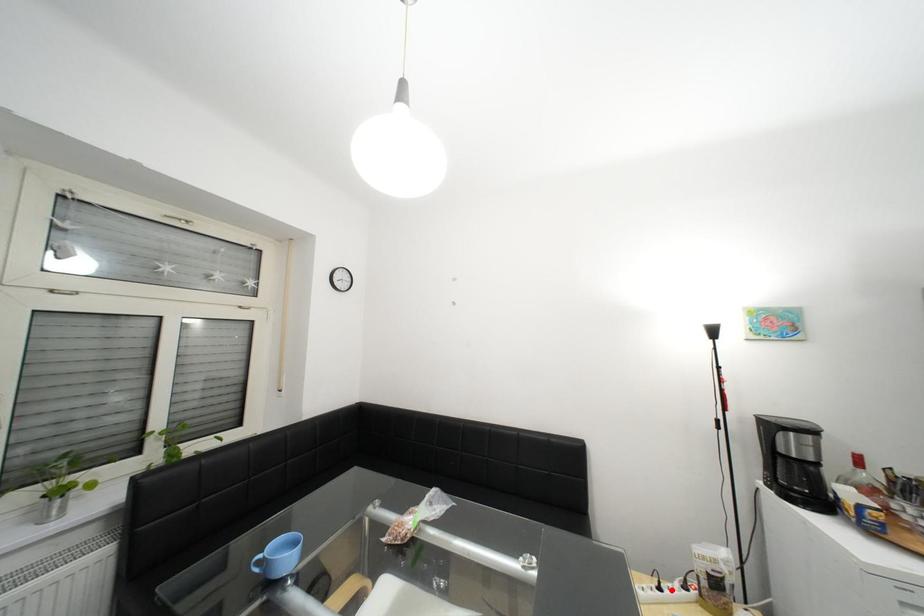
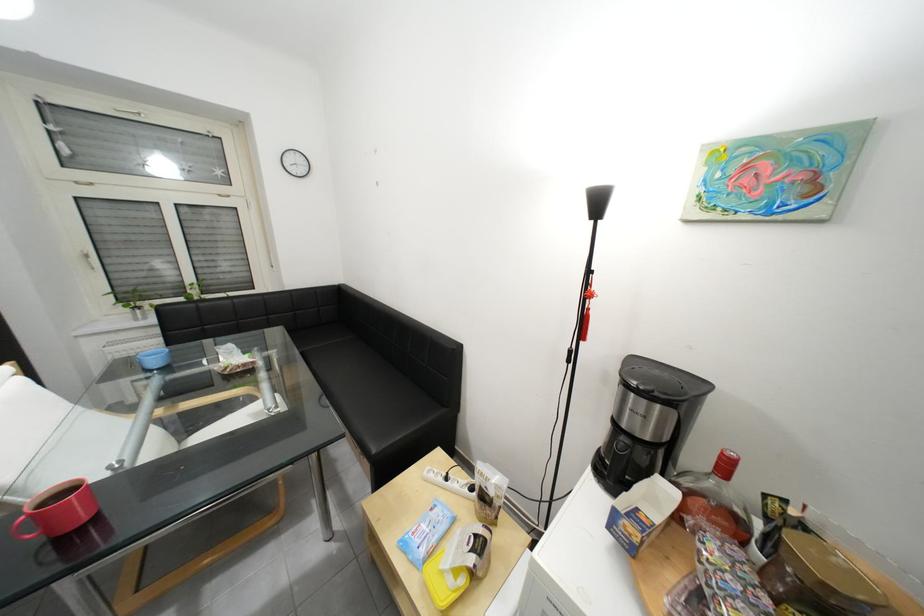
Question: I am providing you with two images of the same scene from different viewpoints. A red point is shown in image1. For the corresponding object point in image2, is it positioned nearer or farther from the camera?

Choices:
 (A) Nearer
 (B) Farther

Answer: (A)